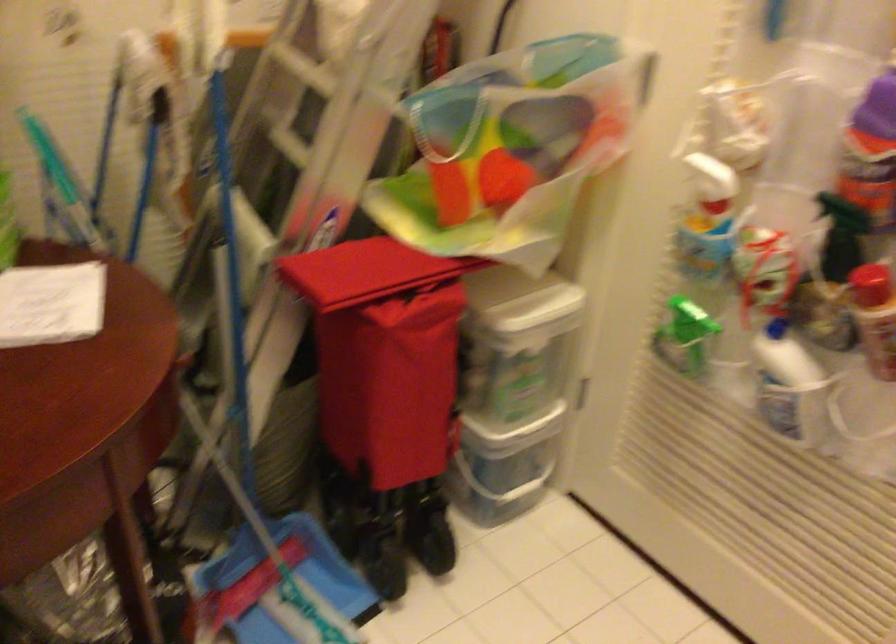
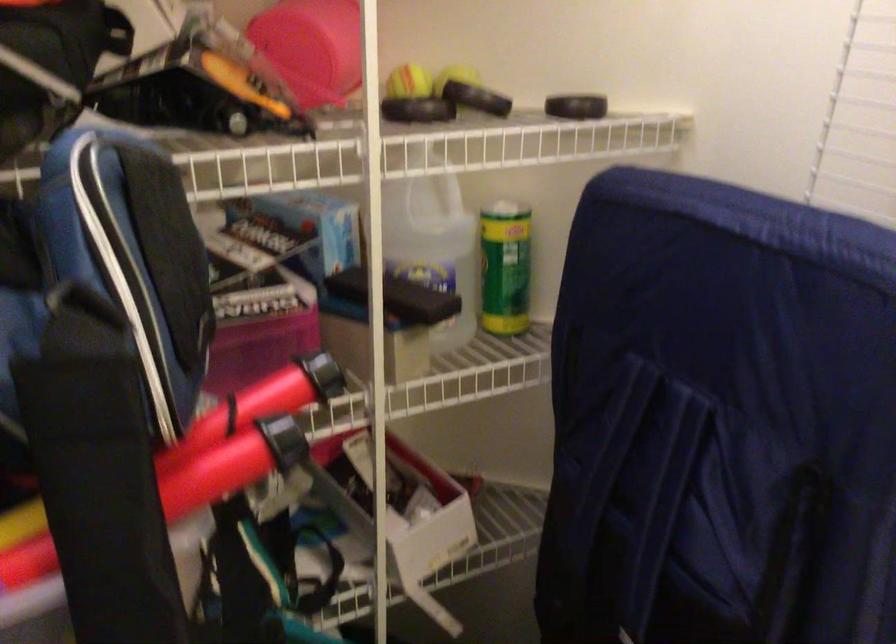
The first image is from the beginning of the video and the second image is from the end. How did the camera likely rotate when shooting the video?

The rotation direction of the camera is left-down.